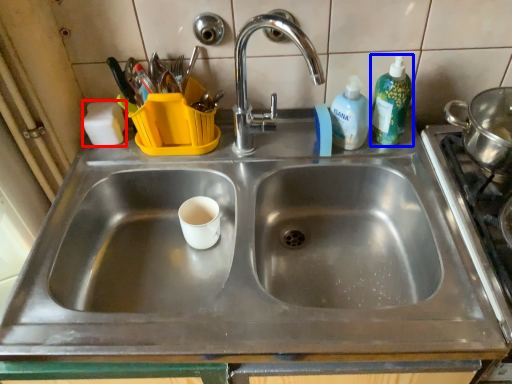
Question: Among these objects, which one is farthest to the camera, soap (highlighted by a red box) or cleaning product (highlighted by a blue box)?

Choices:
 (A) soap
 (B) cleaning product

Answer: (A)